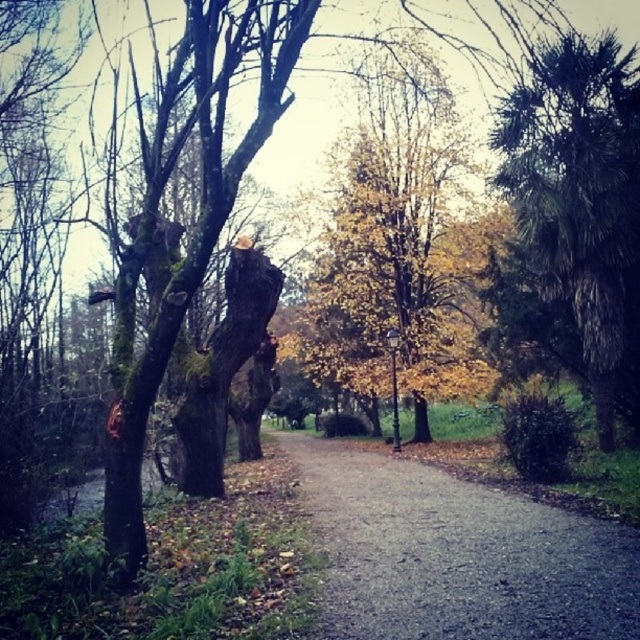
Is yellow leafy tree at center below green leafy palm at right?

Actually, yellow leafy tree at center is above green leafy palm at right.

Can you confirm if yellow leafy tree at center is wider than green leafy palm at right?

Incorrect, yellow leafy tree at center's width does not surpass green leafy palm at right's.

Identify the location of yellow leafy tree at center. (392, 241).

Is point (483, 624) positioned before point (323, 273)?

Yes, point (483, 624) is closer to viewer.

Does brown gravel path at center have a smaller size compared to yellow leafy tree at center?

No, brown gravel path at center is not smaller than yellow leafy tree at center.

Which is behind, point (472, 609) or point (436, 81)?

Positioned behind is point (436, 81).

The height and width of the screenshot is (640, 640). I want to click on brown gravel path at center, so 456,554.

Can you confirm if brown gravel path at center is wider than green leafy palm at right?

Yes.

Is brown gravel path at center in front of green leafy palm at right?

That is True.

Which is in front, point (497, 577) or point (634, 266)?

Point (497, 577) is in front.

This screenshot has width=640, height=640. I want to click on brown gravel path at center, so tap(456, 554).